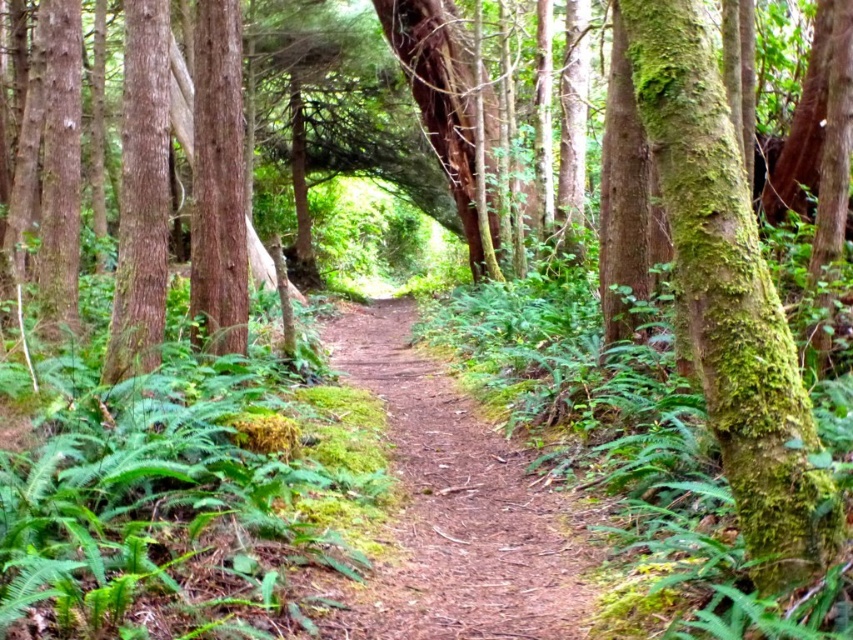
You are a hiker standing at the center of the forest trail. You notice a green mossy bark tree at right. Can you estimate its coordinates in the image?

The green mossy bark tree at right is located at coordinates point (730, 300).

Consider the image. You are a hiker carrying a 36 inch long backpack. You see the green mossy bark tree at right and the brown dirt path at center. Can you place your backpack horizontally between them without bending it?

The distance between the green mossy bark tree at right and the brown dirt path at center is 32.23 inches, which is shorter than the 36 inch backpack. Therefore, the backpack cannot be placed horizontally between them without bending.